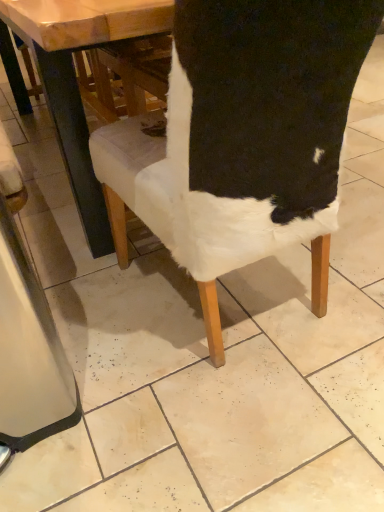
The width and height of the screenshot is (384, 512). What do you see at coordinates (264, 102) in the screenshot?
I see `white fur chair at center` at bounding box center [264, 102].

The image size is (384, 512). Find the location of `white fur chair at center`. white fur chair at center is located at coordinates (264, 102).

This screenshot has height=512, width=384. In order to click on white fur chair at center in this screenshot , I will do `click(264, 102)`.